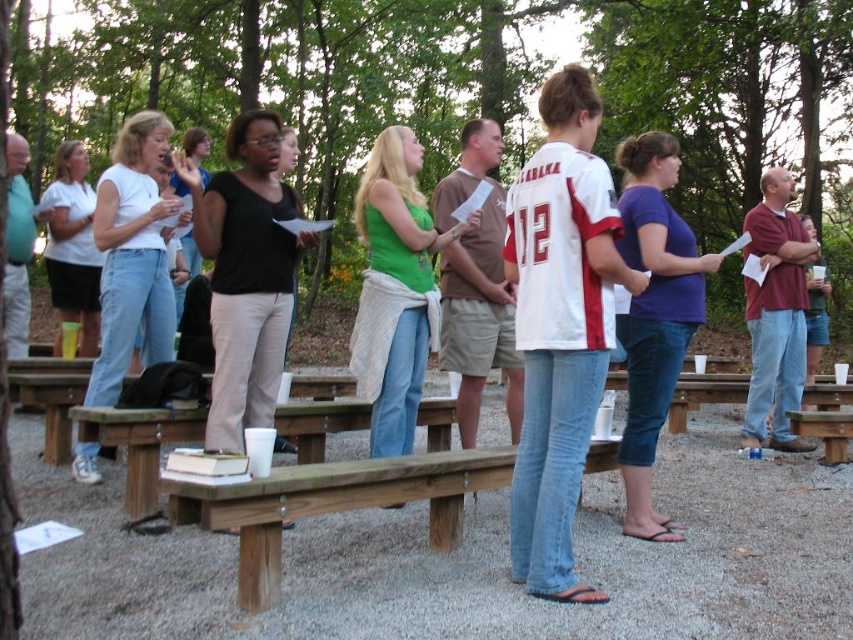
Can you confirm if brown wooden bench at center is wider than brown wooden bench at lower right?

Indeed, brown wooden bench at center has a greater width compared to brown wooden bench at lower right.

Is brown wooden bench at center behind brown wooden bench at lower right?

No, brown wooden bench at center is in front of brown wooden bench at lower right.

Where is `brown wooden bench at center`? This screenshot has width=853, height=640. brown wooden bench at center is located at coordinates (334, 502).

You are a GUI agent. You are given a task and a screenshot of the screen. Output one action in this format:
    pyautogui.click(x=<x>, y=<y>)
    Task: Click on the brown wooden bench at center
    This screenshot has height=640, width=853.
    Given the screenshot: What is the action you would take?
    pyautogui.click(x=334, y=502)